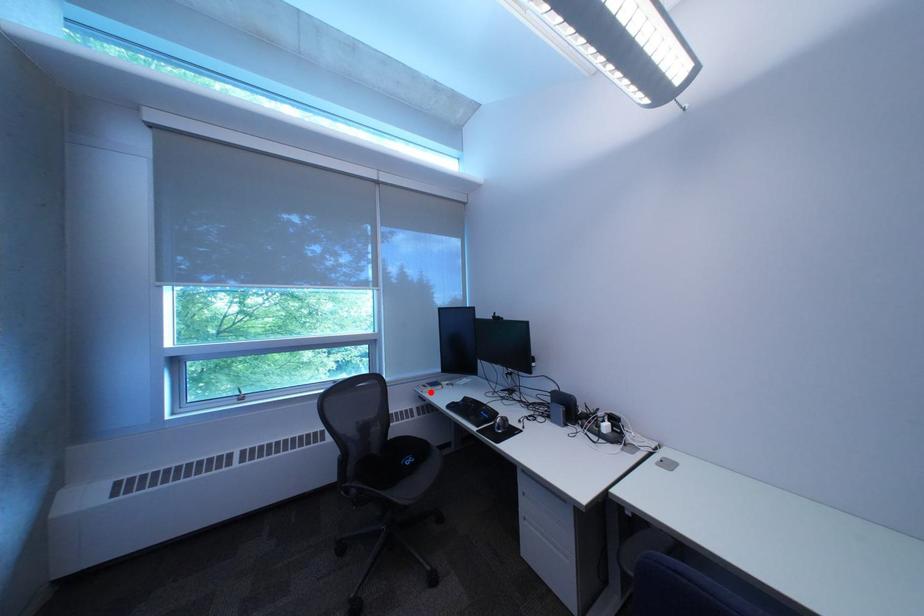
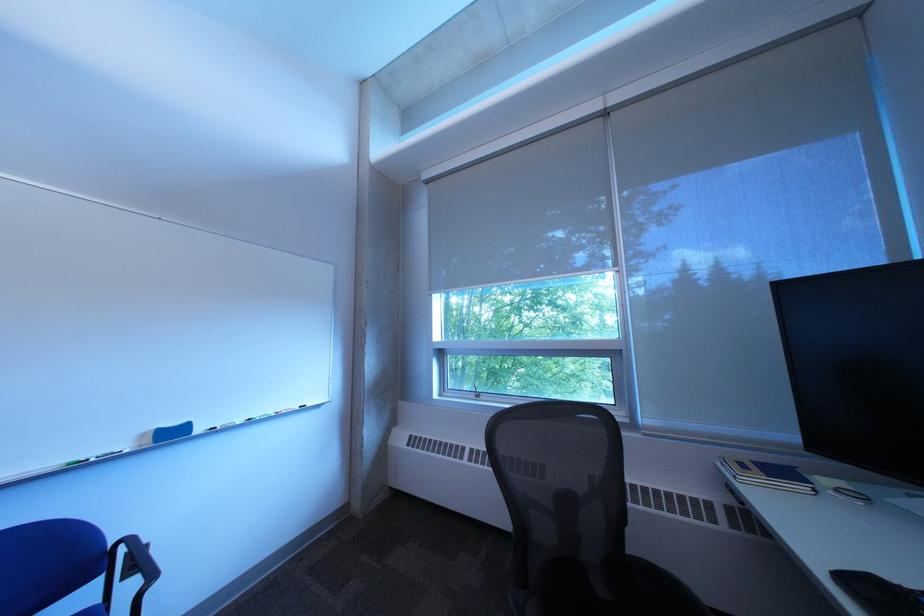
Question: I am providing you with two images of the same scene from different viewpoints. A red point is shown in image1. For the corresponding object point in image2, is it positioned nearer or farther from the camera?

Choices:
 (A) Nearer
 (B) Farther

Answer: (A)